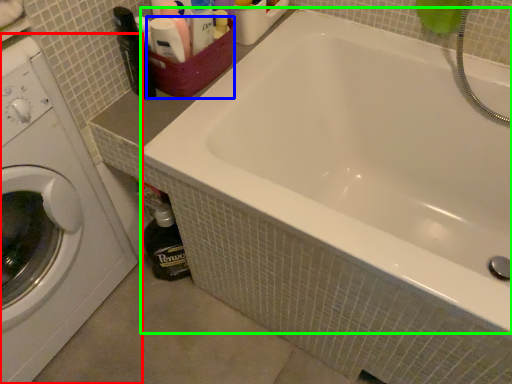
Question: Which object is the closest to the washing machine (highlighted by a red box)? Choose among these: basket (highlighted by a blue box) or bathtub (highlighted by a green box).

Choices:
 (A) basket
 (B) bathtub

Answer: (A)